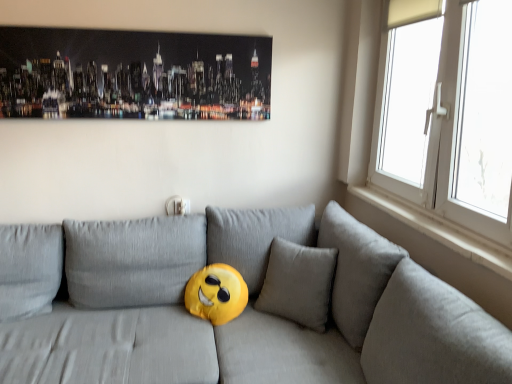
Where is `vacant space underneath white plastic window at right (from a real-world perspective)`? The height and width of the screenshot is (384, 512). vacant space underneath white plastic window at right (from a real-world perspective) is located at coordinates (410, 213).